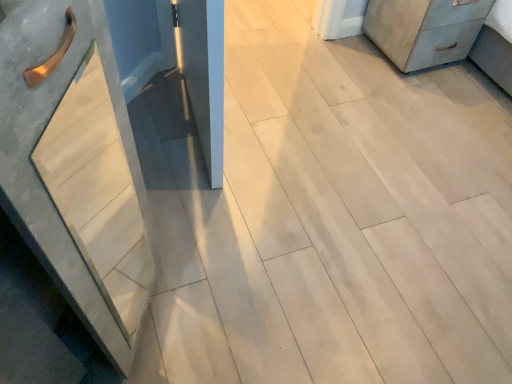
Measure the distance between matte gray chest of drawers at upper right and camera.

5.86 feet.

This screenshot has width=512, height=384. What do you see at coordinates (424, 30) in the screenshot?
I see `matte gray chest of drawers at upper right` at bounding box center [424, 30].

I want to click on matte gray chest of drawers at upper right, so click(424, 30).

At what (x,y) coordinates should I click in order to perform the action: click on matte gray chest of drawers at upper right. Please return your answer as a coordinate pair (x, y). The height and width of the screenshot is (384, 512). Looking at the image, I should click on (424, 30).